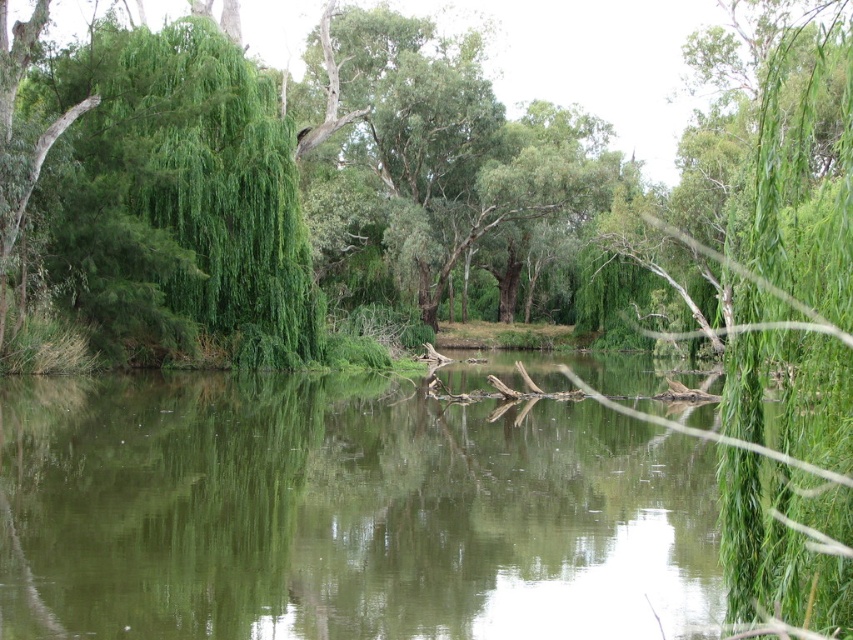
Question: Which of the following is the farthest from the observer?

Choices:
 (A) green reflective water at center
 (B) green leafy willow at left
 (C) green leafy tree at center

Answer: (B)

Question: Can you confirm if green reflective water at center is bigger than green leafy tree at center?

Choices:
 (A) yes
 (B) no

Answer: (B)

Question: Considering the relative positions of green leafy tree at center and green leafy willow at left in the image provided, where is green leafy tree at center located with respect to green leafy willow at left?

Choices:
 (A) above
 (B) below

Answer: (A)

Question: Which of the following is the closest to the observer?

Choices:
 (A) green leafy willow at left
 (B) green leafy tree at center
 (C) green reflective water at center

Answer: (C)

Question: Which of the following is the farthest from the observer?

Choices:
 (A) green leafy tree at center
 (B) green leafy willow at left
 (C) green reflective water at center

Answer: (B)

Question: Does green reflective water at center have a smaller size compared to green leafy willow at left?

Choices:
 (A) yes
 (B) no

Answer: (B)